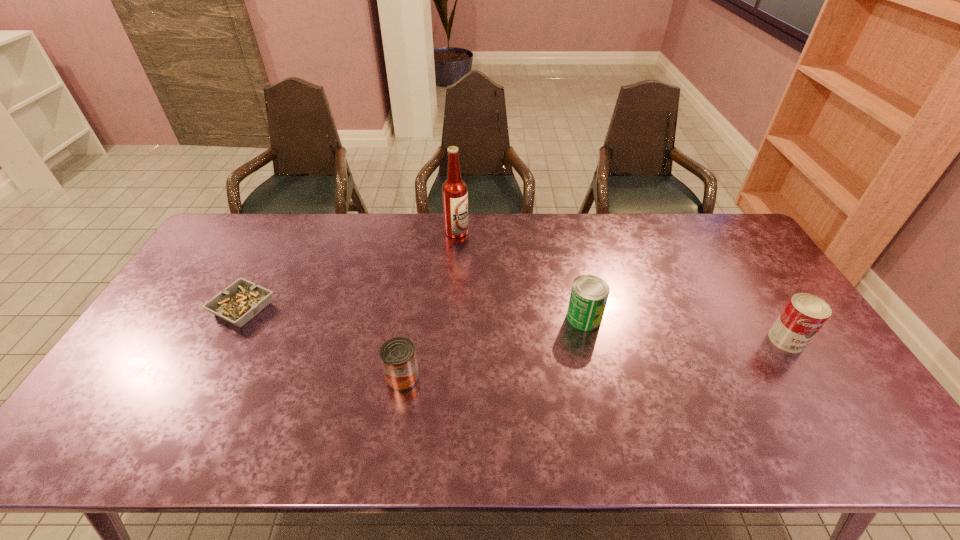
In order to click on the farthest object in this screenshot , I will do `click(454, 190)`.

What are the coordinates of `alcohol` in the screenshot? It's located at (454, 190).

Identify the location of the rightmost can. The width and height of the screenshot is (960, 540). (804, 314).

Find the location of a particular element. The image size is (960, 540). the second object from right to left is located at coordinates [589, 294].

Locate an element on the screen. Image resolution: width=960 pixels, height=540 pixels. the fourth object from right to left is located at coordinates (398, 356).

Where is `the leftmost can`? This screenshot has width=960, height=540. the leftmost can is located at coordinates (398, 356).

Locate an element on the screen. This screenshot has width=960, height=540. ashtray is located at coordinates (242, 300).

The height and width of the screenshot is (540, 960). I want to click on the shortest object, so click(x=242, y=300).

This screenshot has height=540, width=960. Find the location of `free space located 0.120m on the label side of the tallest object`. free space located 0.120m on the label side of the tallest object is located at coordinates (502, 232).

Identify the location of free location located on the front label of the rightmost object. (827, 402).